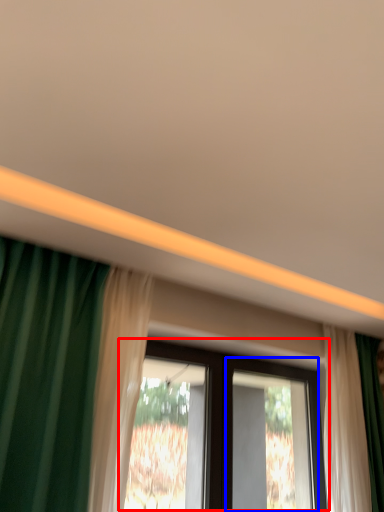
Question: Which object is closer to the camera taking this photo, window (highlighted by a red box) or screen door (highlighted by a blue box)?

Choices:
 (A) window
 (B) screen door

Answer: (A)